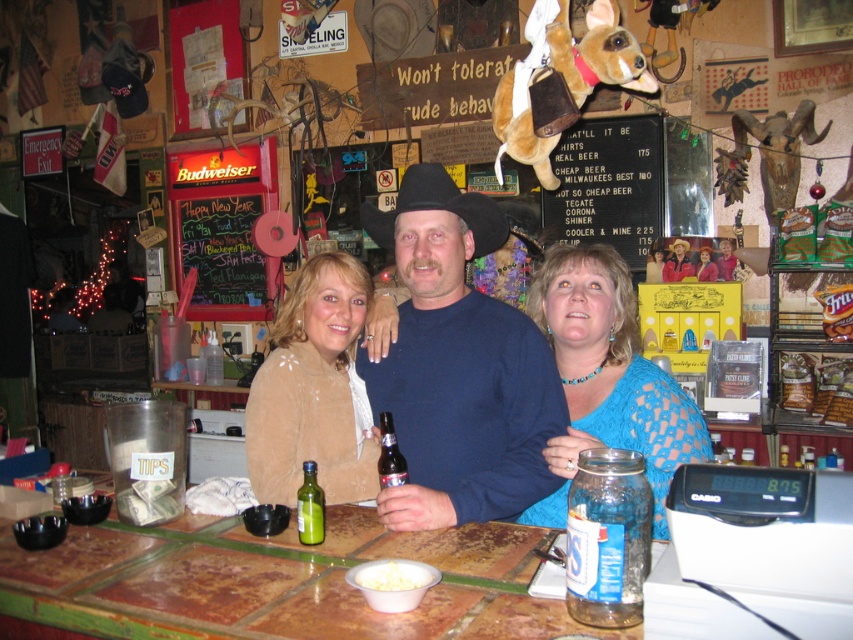
Who is taller, chalkboard at center or green glass bottle at center?

With more height is chalkboard at center.

Does point (219, 221) come closer to viewer compared to point (314, 522)?

No, it is not.

Which is in front, point (218, 248) or point (314, 492)?

Point (314, 492)

The width and height of the screenshot is (853, 640). I want to click on chalkboard at center, so click(x=221, y=256).

Is blue lace dress at center positioned at the back of clear glass jar at center?

Yes, blue lace dress at center is further from the viewer.

Which is below, blue lace dress at center or clear glass jar at center?

Positioned lower is clear glass jar at center.

Who is more forward, (581, 316) or (590, 589)?

Positioned in front is point (590, 589).

This screenshot has height=640, width=853. I want to click on blue lace dress at center, so click(x=607, y=378).

Does clear glass jar at center have a lesser height compared to green glass bottle at center?

In fact, clear glass jar at center may be taller than green glass bottle at center.

Which is more to the left, clear glass jar at center or green glass bottle at center?

green glass bottle at center is more to the left.

Measure the distance between point (647,547) and camera.

They are 1.28 meters apart.

This screenshot has height=640, width=853. Identify the location of clear glass jar at center. (607, 538).